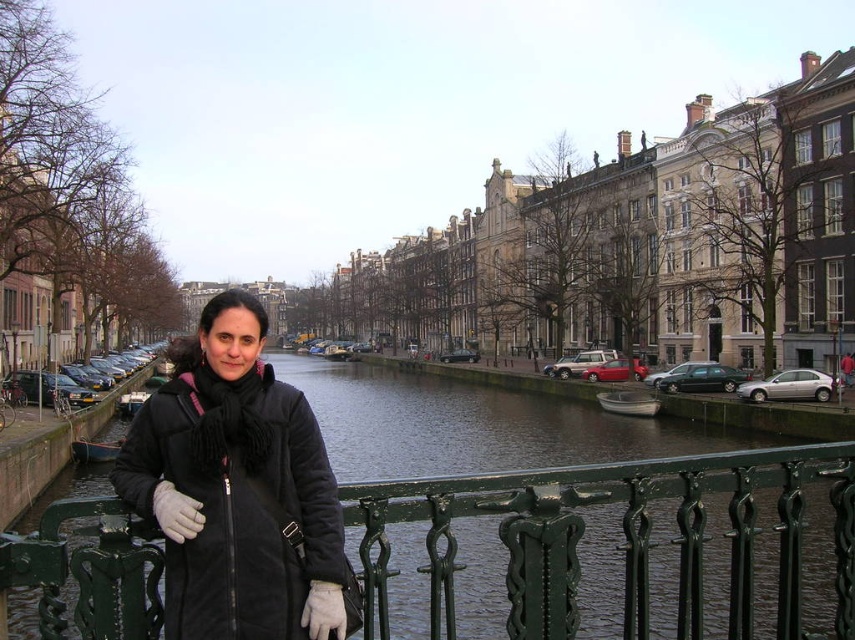
Does point (609, 612) come closer to viewer compared to point (351, 614)?

No, (609, 612) is further to viewer.

Does green painted metal railing at center have a larger size compared to black suede coat at center?

Yes.

I want to click on green painted metal railing at center, so click(x=624, y=547).